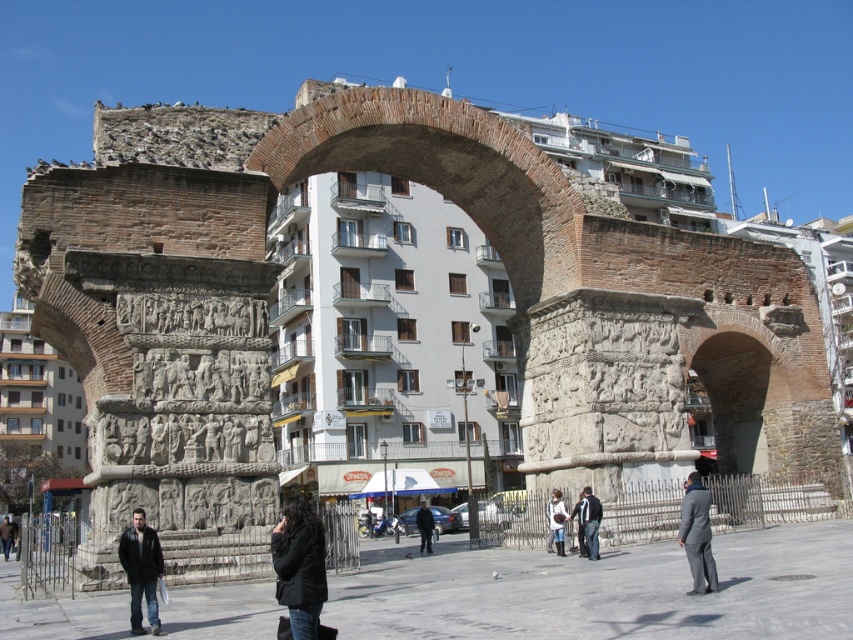
Question: Observing the image, what is the correct spatial positioning of dark gray jacket at lower left in reference to white cotton jacket at center?

Choices:
 (A) left
 (B) right

Answer: (A)

Question: Which point is farther from the camera taking this photo?

Choices:
 (A) (1, 545)
 (B) (579, 516)
 (C) (274, 536)
 (D) (428, 529)

Answer: (A)

Question: Is white cotton jacket at center above dark blue jacket at center?

Choices:
 (A) yes
 (B) no

Answer: (A)

Question: Among these objects, which one is farthest from the camera?

Choices:
 (A) dark gray jacket at lower center
 (B) dark blue jacket at center
 (C) white cotton jacket at center

Answer: (B)

Question: Does dark gray jacket at lower left have a smaller size compared to dark blue jacket at center?

Choices:
 (A) yes
 (B) no

Answer: (A)

Question: Which object appears closest to the camera in this image?

Choices:
 (A) white cotton jacket at center
 (B) dark gray jacket at center

Answer: (B)